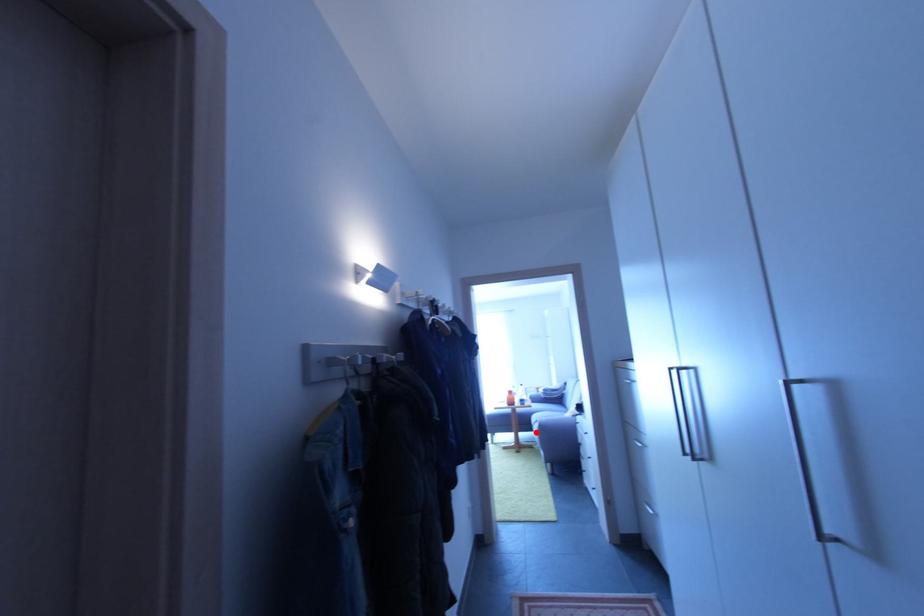
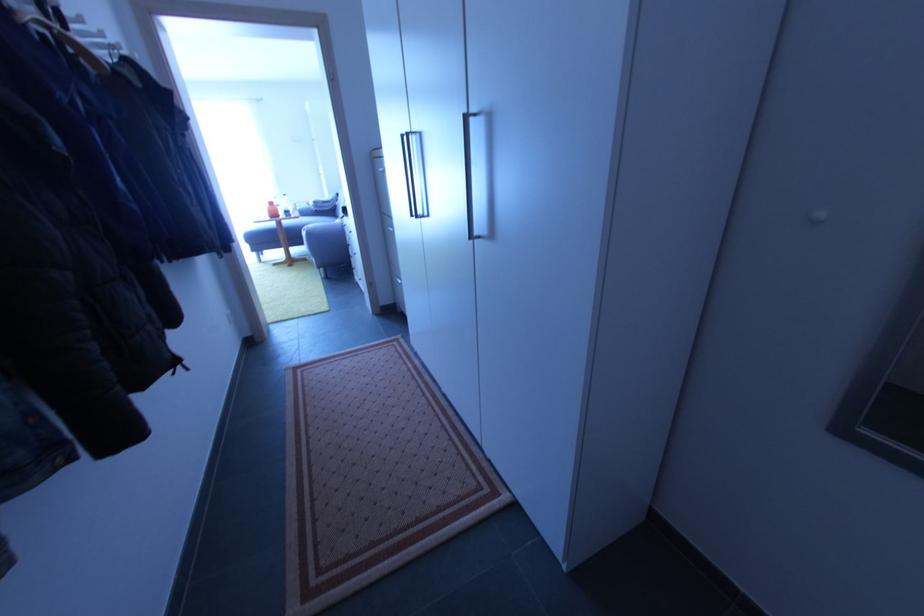
Question: I am providing you with two images of the same scene from different viewpoints. In image1, a red point is highlighted. Considering the same 3D point in image2, which of the following is correct?

Choices:
 (A) It is closer
 (B) It is farther

Answer: (A)